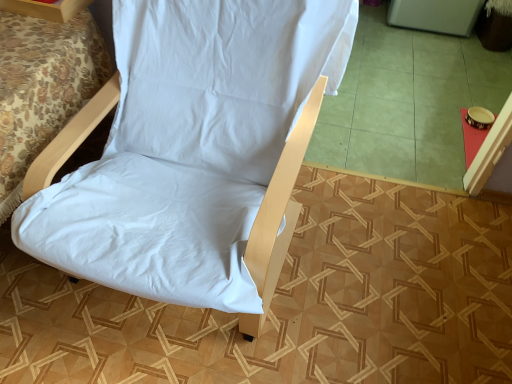
Question: Is white fabric chair at center to the left of white fabric bed at lower left from the viewer's perspective?

Choices:
 (A) no
 (B) yes

Answer: (A)

Question: Is white fabric chair at center thinner than white fabric bed at lower left?

Choices:
 (A) no
 (B) yes

Answer: (B)

Question: Would you consider white fabric chair at center to be distant from white fabric bed at lower left?

Choices:
 (A) yes
 (B) no

Answer: (B)

Question: Does white fabric chair at center have a lesser height compared to white fabric bed at lower left?

Choices:
 (A) yes
 (B) no

Answer: (B)

Question: Is white fabric chair at center directly adjacent to white fabric bed at lower left?

Choices:
 (A) yes
 (B) no

Answer: (B)

Question: Is white fabric chair at center smaller than white fabric bed at lower left?

Choices:
 (A) yes
 (B) no

Answer: (B)

Question: Is green tile at center at the left side of white fabric chair at upper left?

Choices:
 (A) yes
 (B) no

Answer: (B)

Question: Is green tile at center further to the viewer compared to white fabric chair at upper left?

Choices:
 (A) no
 (B) yes

Answer: (B)

Question: Does green tile at center lie in front of white fabric chair at upper left?

Choices:
 (A) no
 (B) yes

Answer: (A)

Question: Is there a large distance between green tile at center and white fabric chair at upper left?

Choices:
 (A) yes
 (B) no

Answer: (A)

Question: Are green tile at center and white fabric chair at upper left beside each other?

Choices:
 (A) no
 (B) yes

Answer: (A)

Question: Does green tile at center have a lesser height compared to white fabric chair at upper left?

Choices:
 (A) yes
 (B) no

Answer: (A)

Question: Considering the relative sizes of white fabric chair at upper left and white fabric bed at lower left in the image provided, is white fabric chair at upper left thinner than white fabric bed at lower left?

Choices:
 (A) no
 (B) yes

Answer: (B)